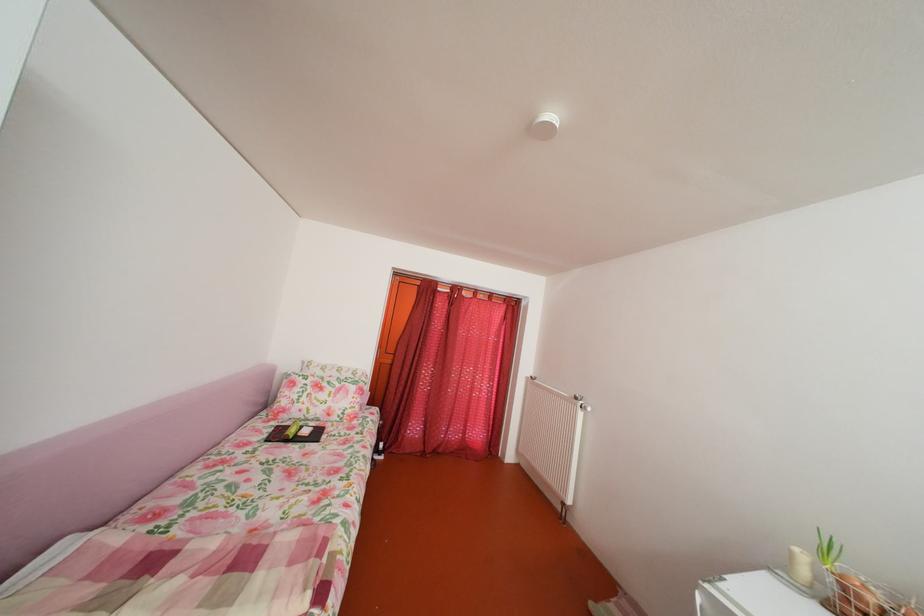
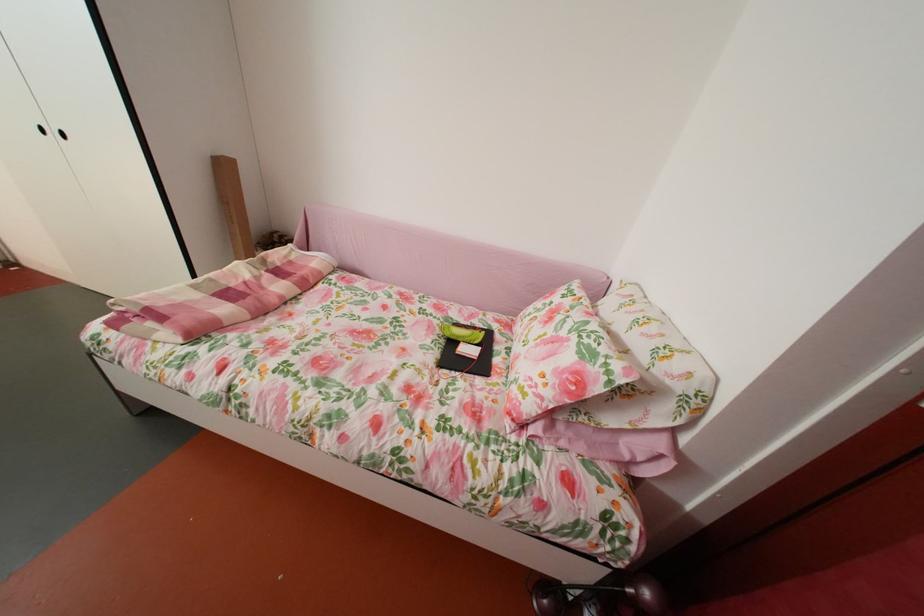
Where in the second image is the point corresponding to [276,442] from the first image?

(473, 328)